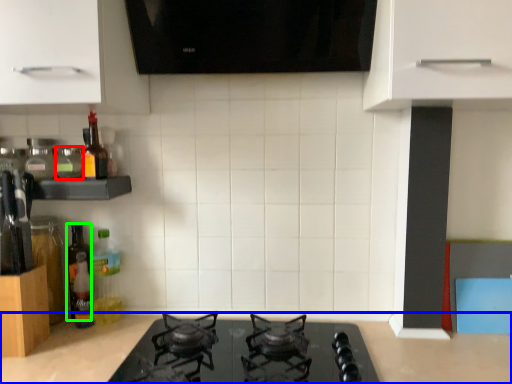
Question: Which object is positioned closest to bottle (highlighted by a red box)? Select from countertop (highlighted by a blue box) and bottle (highlighted by a green box).

Choices:
 (A) countertop
 (B) bottle

Answer: (B)